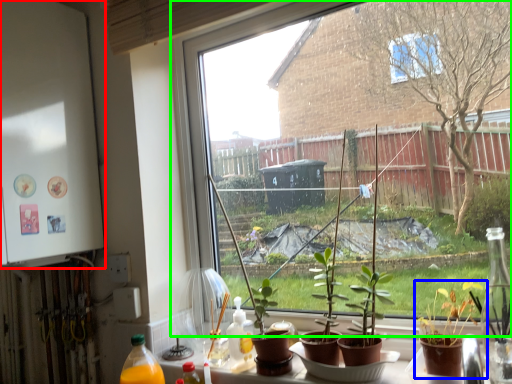
Question: Estimate the real-world distances between objects in this image. Which object is farther from back (highlighted by a red box), houseplant (highlighted by a blue box) or window (highlighted by a green box)?

Choices:
 (A) houseplant
 (B) window

Answer: (A)